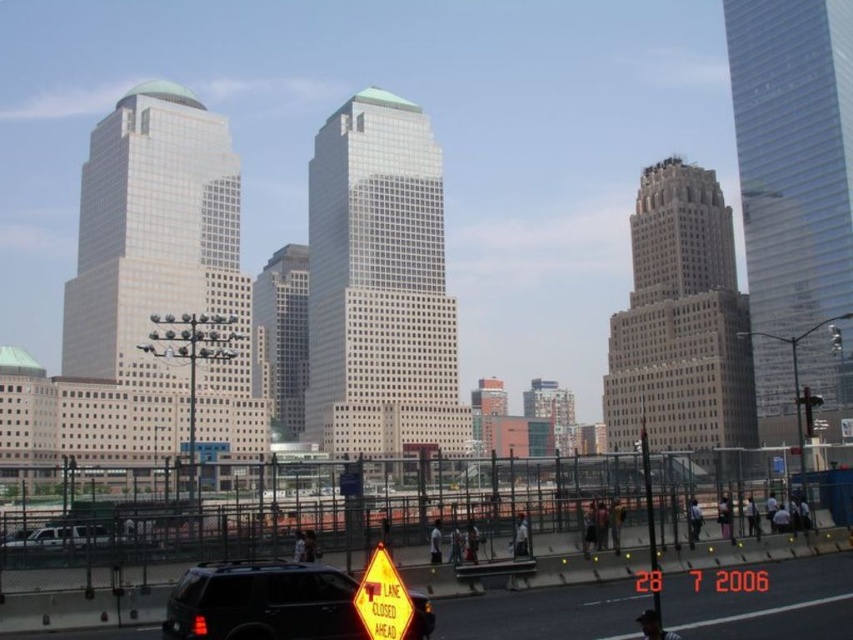
Question: Which point is closer to the camera?

Choices:
 (A) silver metallic suv at lower left
 (B) yellow reflective plastic traffic sign at lower center
 (C) black matte suv at lower left

Answer: (B)

Question: Which object is farther from the camera taking this photo?

Choices:
 (A) black matte suv at lower left
 (B) yellow reflective plastic traffic sign at lower center
 (C) silver metallic suv at lower left

Answer: (C)

Question: Can you confirm if yellow reflective plastic traffic sign at lower center is thinner than silver metallic suv at lower left?

Choices:
 (A) no
 (B) yes

Answer: (A)

Question: Is black matte suv at lower left positioned behind yellow reflective plastic traffic sign at lower center?

Choices:
 (A) no
 (B) yes

Answer: (B)

Question: From the image, what is the correct spatial relationship of yellow reflective plastic traffic sign at lower center in relation to silver metallic suv at lower left?

Choices:
 (A) left
 (B) right

Answer: (B)

Question: Which of these objects is positioned closest to the silver metallic suv at lower left?

Choices:
 (A) black matte suv at lower left
 (B) yellow reflective plastic traffic sign at lower center

Answer: (A)